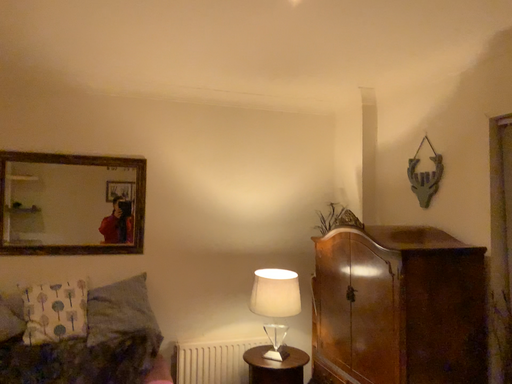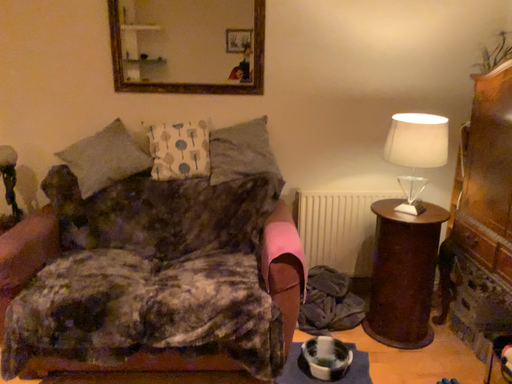
Question: Which way did the camera rotate in the video?

Choices:
 (A) rotated upward
 (B) rotated downward

Answer: (B)